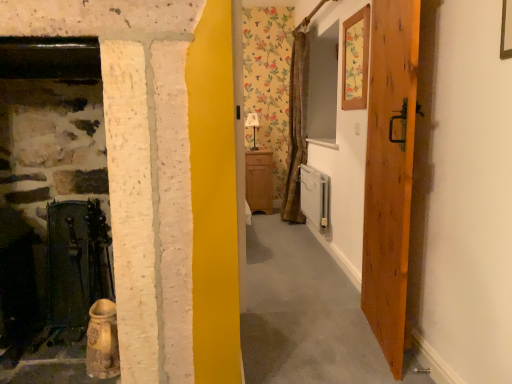
Question: Is matte white lamp at center at the left side of white glossy radiator at lower right?

Choices:
 (A) no
 (B) yes

Answer: (B)

Question: Does matte white lamp at center have a smaller size compared to white glossy radiator at lower right?

Choices:
 (A) no
 (B) yes

Answer: (B)

Question: Is white glossy radiator at lower right inside matte white lamp at center?

Choices:
 (A) no
 (B) yes

Answer: (A)

Question: Can you confirm if matte white lamp at center is thinner than white glossy radiator at lower right?

Choices:
 (A) yes
 (B) no

Answer: (B)

Question: Would you say matte white lamp at center is a long distance from white glossy radiator at lower right?

Choices:
 (A) no
 (B) yes

Answer: (B)

Question: Considering the relative sizes of matte white lamp at center and white glossy radiator at lower right in the image provided, is matte white lamp at center wider than white glossy radiator at lower right?

Choices:
 (A) yes
 (B) no

Answer: (A)

Question: Is matte wood cabinet at center to the right of matte white lamp at center from the viewer's perspective?

Choices:
 (A) yes
 (B) no

Answer: (A)

Question: Does matte wood cabinet at center come behind matte white lamp at center?

Choices:
 (A) yes
 (B) no

Answer: (B)

Question: Considering the relative positions of matte wood cabinet at center and matte white lamp at center in the image provided, is matte wood cabinet at center in front of matte white lamp at center?

Choices:
 (A) no
 (B) yes

Answer: (B)

Question: Are matte wood cabinet at center and matte white lamp at center located far from each other?

Choices:
 (A) no
 (B) yes

Answer: (A)

Question: From a real-world perspective, is matte wood cabinet at center on top of matte white lamp at center?

Choices:
 (A) yes
 (B) no

Answer: (B)

Question: Can you confirm if matte wood cabinet at center is shorter than matte white lamp at center?

Choices:
 (A) yes
 (B) no

Answer: (B)

Question: Does matte white lamp at center have a smaller size compared to wooden door at right?

Choices:
 (A) no
 (B) yes

Answer: (B)